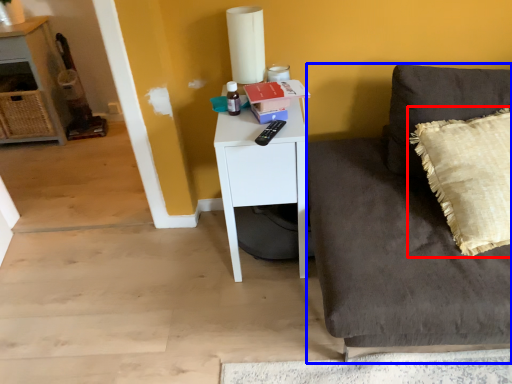
Question: Among these objects, which one is nearest to the camera, pillow (highlighted by a red box) or studio couch (highlighted by a blue box)?

Choices:
 (A) pillow
 (B) studio couch

Answer: (B)